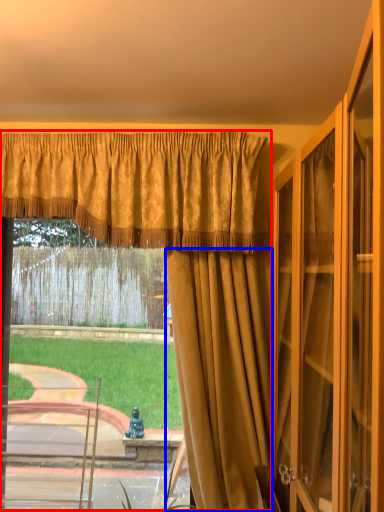
Question: Which point is closer to the camera, curtain (highlighted by a red box) or curtain (highlighted by a blue box)?

Choices:
 (A) curtain
 (B) curtain

Answer: (B)